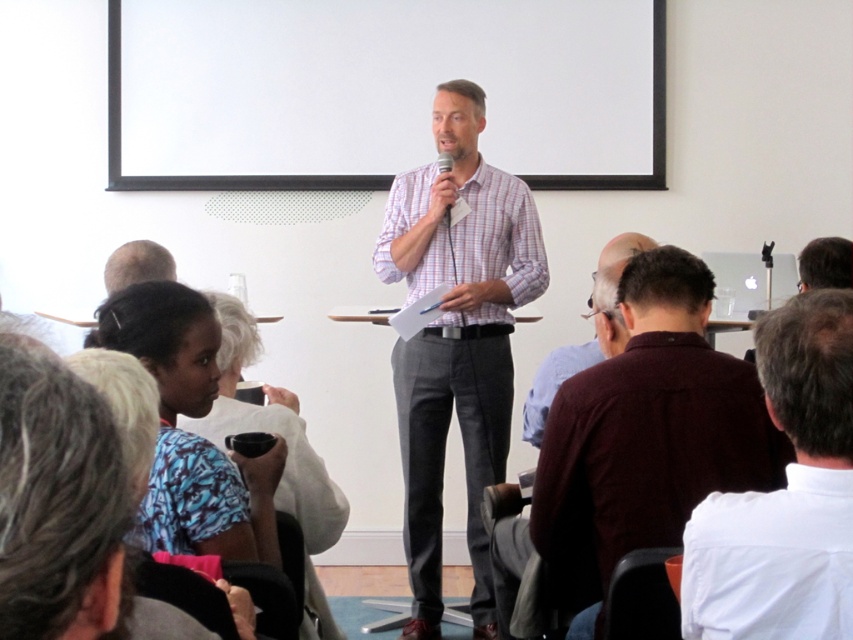
Does point (474, 531) lie in front of point (292, 449)?

No, it is behind (292, 449).

At what (x,y) coordinates should I click in order to perform the action: click on plaid cotton shirt at center. Please return your answer as a coordinate pair (x, y). Looking at the image, I should click on (456, 339).

Can you confirm if plaid cotton shirt at center is taller than maroon sweater at center?

Indeed, plaid cotton shirt at center has a greater height compared to maroon sweater at center.

In the scene shown: Is plaid cotton shirt at center smaller than maroon sweater at center?

No, plaid cotton shirt at center is not smaller than maroon sweater at center.

Between point (440, 413) and point (614, 257), which one is positioned behind?

The point (440, 413) is behind.

This screenshot has height=640, width=853. What are the coordinates of `plaid cotton shirt at center` in the screenshot? It's located at (456, 339).

Based on the photo, is dark maroon shirt at center below blue patterned shirt at lower left?

Actually, dark maroon shirt at center is above blue patterned shirt at lower left.

The image size is (853, 640). What do you see at coordinates (651, 424) in the screenshot? I see `dark maroon shirt at center` at bounding box center [651, 424].

Locate an element on the screen. dark maroon shirt at center is located at coordinates (651, 424).

Where is `dark maroon shirt at center`? dark maroon shirt at center is located at coordinates (651, 424).